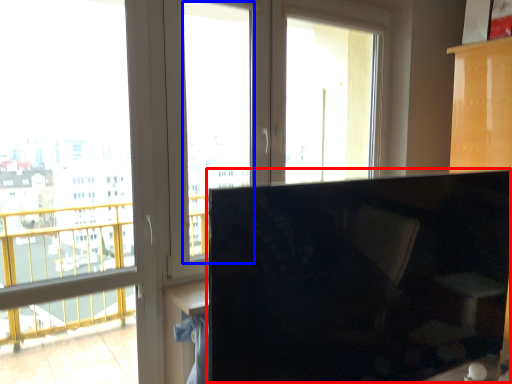
Question: Which point is closer to the camera, computer monitor (highlighted by a red box) or window screen (highlighted by a blue box)?

Choices:
 (A) computer monitor
 (B) window screen

Answer: (A)